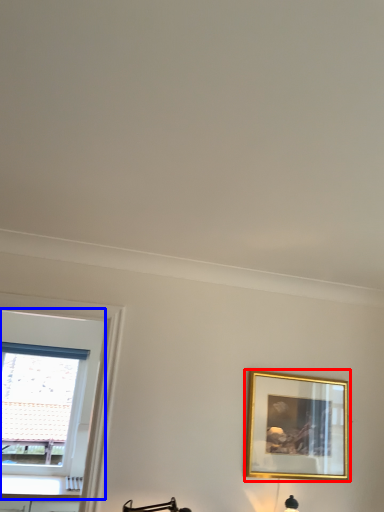
Question: Which of the following is the farthest to the observer, picture frame (highlighted by a red box) or window (highlighted by a blue box)?

Choices:
 (A) picture frame
 (B) window

Answer: (B)